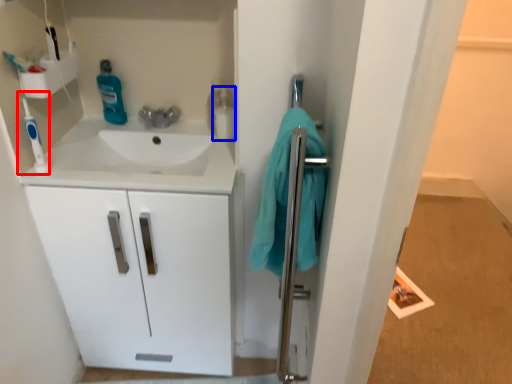
Question: Which object appears closest to the camera in this image, toothbrush (highlighted by a red box) or cleaning product (highlighted by a blue box)?

Choices:
 (A) toothbrush
 (B) cleaning product

Answer: (A)